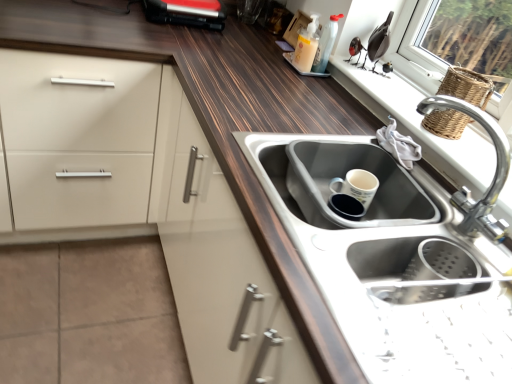
Image resolution: width=512 pixels, height=384 pixels. In order to click on free spot in front of woven brown basket at upper right in this screenshot , I will do `click(460, 152)`.